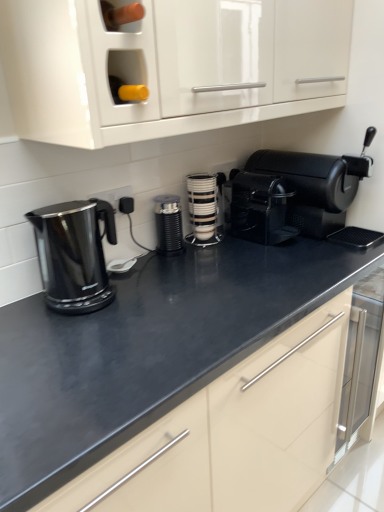
The height and width of the screenshot is (512, 384). What do you see at coordinates (114, 195) in the screenshot? I see `black plastic electric outlet at center` at bounding box center [114, 195].

Where is `black plastic coffee maker at center`? black plastic coffee maker at center is located at coordinates (260, 208).

What do you see at coordinates (170, 66) in the screenshot? The width and height of the screenshot is (384, 512). I see `white glossy cabinet at upper center` at bounding box center [170, 66].

What do you see at coordinates (168, 224) in the screenshot? The height and width of the screenshot is (512, 384). I see `black matte coffee grinder at center, which is the first kitchen appliance from left to right` at bounding box center [168, 224].

Locate an element on the screen. black plastic electric outlet at center is located at coordinates (114, 195).

Considering the sizes of objects black matte coffee grinder at center, which is the first kitchen appliance from left to right, and black plastic electric outlet at center in the image provided, who is bigger, black matte coffee grinder at center, which is the first kitchen appliance from left to right, or black plastic electric outlet at center?

black matte coffee grinder at center, which is the first kitchen appliance from left to right, is bigger.

Would you say black matte coffee grinder at center, which is the first kitchen appliance from left to right, is to the left or to the right of black plastic electric outlet at center in the picture?

black matte coffee grinder at center, which is the first kitchen appliance from left to right, is positioned on black plastic electric outlet at center's right side.

From the image's perspective, between black matte coffee grinder at center, which is counted as the second kitchen appliance, starting from the right, and black plastic electric outlet at center, which one is located above?

black plastic electric outlet at center.

Locate an element on the screen. The height and width of the screenshot is (512, 384). coffee machine above the black plastic coffee maker at center (from the image's perspective) is located at coordinates (293, 194).

Is black matte coffee machine at right oriented towards black plastic coffee maker at center?

No, black matte coffee machine at right is not turned towards black plastic coffee maker at center.

Is black matte coffee machine at right directly adjacent to black plastic coffee maker at center?

Indeed, black matte coffee machine at right and black plastic coffee maker at center are beside each other and touching.

Considering the sizes of objects black matte coffee machine at right and black plastic coffee maker at center in the image provided, who is smaller, black matte coffee machine at right or black plastic coffee maker at center?

With smaller size is black plastic coffee maker at center.

Is black plastic electric outlet at center far from white glossy cabinet at upper center?

No, black plastic electric outlet at center is not far from white glossy cabinet at upper center.

Is point (125, 193) closer to camera compared to point (31, 116)?

That is False.

Considering the sizes of objects black plastic electric outlet at center and white glossy cabinet at upper center in the image provided, who is taller, black plastic electric outlet at center or white glossy cabinet at upper center?

white glossy cabinet at upper center.

Is white glossy cup stack at center, arranged as the 2th kitchen appliance when viewed from the left, taller or shorter than black glossy electric kettle at left?

Clearly, white glossy cup stack at center, arranged as the 2th kitchen appliance when viewed from the left, is shorter compared to black glossy electric kettle at left.

Between white glossy cup stack at center, arranged as the 2th kitchen appliance when viewed from the left, and black glossy electric kettle at left, which one has larger width?

black glossy electric kettle at left.

Considering their positions, is white glossy cup stack at center, which appears as the first kitchen appliance when viewed from the right, located in front of or behind black glossy electric kettle at left?

Clearly, white glossy cup stack at center, which appears as the first kitchen appliance when viewed from the right, is behind black glossy electric kettle at left.

Is white glossy cup stack at center, arranged as the 2th kitchen appliance when viewed from the left, oriented away from black glossy electric kettle at left?

white glossy cup stack at center, arranged as the 2th kitchen appliance when viewed from the left, is not turned away from black glossy electric kettle at left.

Between black matte coffee machine at right and white glossy cabinet at upper center, which one has smaller width?

Thinner between the two is white glossy cabinet at upper center.

Is black matte coffee machine at right at the left side of white glossy cabinet at upper center?

In fact, black matte coffee machine at right is to the right of white glossy cabinet at upper center.

From the picture: Considering the positions of objects black matte coffee machine at right and white glossy cabinet at upper center in the image provided, who is in front, black matte coffee machine at right or white glossy cabinet at upper center?

white glossy cabinet at upper center is closer to the camera.

Is black matte coffee machine at right far from white glossy cabinet at upper center?

No, black matte coffee machine at right is not far from white glossy cabinet at upper center.

Can we say black matte coffee grinder at center, which is the first kitchen appliance from left to right, lies outside white glossy cup stack at center, which appears as the first kitchen appliance when viewed from the right?

black matte coffee grinder at center, which is the first kitchen appliance from left to right, is positioned outside white glossy cup stack at center, which appears as the first kitchen appliance when viewed from the right.

From the image's perspective, between black matte coffee grinder at center, which is counted as the second kitchen appliance, starting from the right, and white glossy cup stack at center, which appears as the first kitchen appliance when viewed from the right, who is located below?

black matte coffee grinder at center, which is counted as the second kitchen appliance, starting from the right.

Considering the positions of objects black matte coffee grinder at center, which is the first kitchen appliance from left to right, and white glossy cup stack at center, arranged as the 2th kitchen appliance when viewed from the left, in the image provided, who is in front, black matte coffee grinder at center, which is the first kitchen appliance from left to right, or white glossy cup stack at center, arranged as the 2th kitchen appliance when viewed from the left,?

black matte coffee grinder at center, which is the first kitchen appliance from left to right, is in front.

Considering the sizes of objects black matte coffee grinder at center, which is the first kitchen appliance from left to right, and white glossy cup stack at center, which appears as the first kitchen appliance when viewed from the right, in the image provided, who is wider, black matte coffee grinder at center, which is the first kitchen appliance from left to right, or white glossy cup stack at center, which appears as the first kitchen appliance when viewed from the right,?

black matte coffee grinder at center, which is the first kitchen appliance from left to right, is wider.

Is black glossy electric kettle at left at the right side of white glossy cabinet at upper center?

No.

Are black glossy electric kettle at left and white glossy cabinet at upper center far apart?

Actually, black glossy electric kettle at left and white glossy cabinet at upper center are a little close together.

Is black glossy electric kettle at left positioned with its back to white glossy cabinet at upper center?

No.

Which of these two, black glossy electric kettle at left or white glossy cabinet at upper center, is thinner?

black glossy electric kettle at left is thinner.

You are a GUI agent. You are given a task and a screenshot of the screen. Output one action in this format:
    pyautogui.click(x=<x>, y=<y>)
    Task: Click on the electric outlet on the left side of black matte coffee grinder at center, which is the first kitchen appliance from left to right
    The height and width of the screenshot is (512, 384).
    Given the screenshot: What is the action you would take?
    pyautogui.click(x=114, y=195)

In order to click on coffee machine that appears in front of the black plastic coffee maker at center in this screenshot , I will do `click(293, 194)`.

Considering their positions, is black plastic coffee maker at center positioned closer to black plastic electric outlet at center than black matte coffee grinder at center, which is counted as the second kitchen appliance, starting from the right?

The object closer to black plastic electric outlet at center is black matte coffee grinder at center, which is counted as the second kitchen appliance, starting from the right.

Considering their positions, is black plastic coffee maker at center positioned closer to black glossy electric kettle at left than black matte coffee machine at right?

Among the two, black plastic coffee maker at center is located nearer to black glossy electric kettle at left.

Looking at the image, which one is located closer to black matte coffee machine at right, black plastic electric outlet at center or white glossy cup stack at center, arranged as the 2th kitchen appliance when viewed from the left?

white glossy cup stack at center, arranged as the 2th kitchen appliance when viewed from the left, is closer to black matte coffee machine at right.

Based on their spatial positions, is black glossy electric kettle at left or black plastic electric outlet at center further from white glossy cabinet at upper center?

black plastic electric outlet at center.

Considering their positions, is white glossy cabinet at upper center positioned further to black glossy electric kettle at left than white glossy cup stack at center, arranged as the 2th kitchen appliance when viewed from the left?

Among the two, white glossy cup stack at center, arranged as the 2th kitchen appliance when viewed from the left, is located further to black glossy electric kettle at left.

Estimate the real-world distances between objects in this image. Which object is closer to black plastic electric outlet at center, black plastic coffee maker at center or black glossy electric kettle at left?

The object closer to black plastic electric outlet at center is black glossy electric kettle at left.

When comparing their distances from white glossy cup stack at center, arranged as the 2th kitchen appliance when viewed from the left, does black matte coffee grinder at center, which is the first kitchen appliance from left to right, or black plastic electric outlet at center seem closer?

The object closer to white glossy cup stack at center, arranged as the 2th kitchen appliance when viewed from the left, is black matte coffee grinder at center, which is the first kitchen appliance from left to right.

Based on their spatial positions, is black plastic electric outlet at center or white glossy cup stack at center, arranged as the 2th kitchen appliance when viewed from the left, closer to white glossy cabinet at upper center?

black plastic electric outlet at center lies closer to white glossy cabinet at upper center than the other object.

Where is `coffeepot between white glossy cabinet at upper center and black matte coffee grinder at center, which is counted as the second kitchen appliance, starting from the right, in the front-back direction`? Image resolution: width=384 pixels, height=512 pixels. coffeepot between white glossy cabinet at upper center and black matte coffee grinder at center, which is counted as the second kitchen appliance, starting from the right, in the front-back direction is located at coordinates (260, 208).

Identify the location of home appliance between white glossy cabinet at upper center and white glossy cup stack at center, which appears as the first kitchen appliance when viewed from the right, in the front-back direction. The height and width of the screenshot is (512, 384). (74, 254).

Image resolution: width=384 pixels, height=512 pixels. Identify the location of electric outlet located between white glossy cabinet at upper center and white glossy cup stack at center, which appears as the first kitchen appliance when viewed from the right, in the depth direction. (114, 195).

The height and width of the screenshot is (512, 384). Identify the location of electric outlet located between black glossy electric kettle at left and white glossy cup stack at center, which appears as the first kitchen appliance when viewed from the right, in the depth direction. (114, 195).